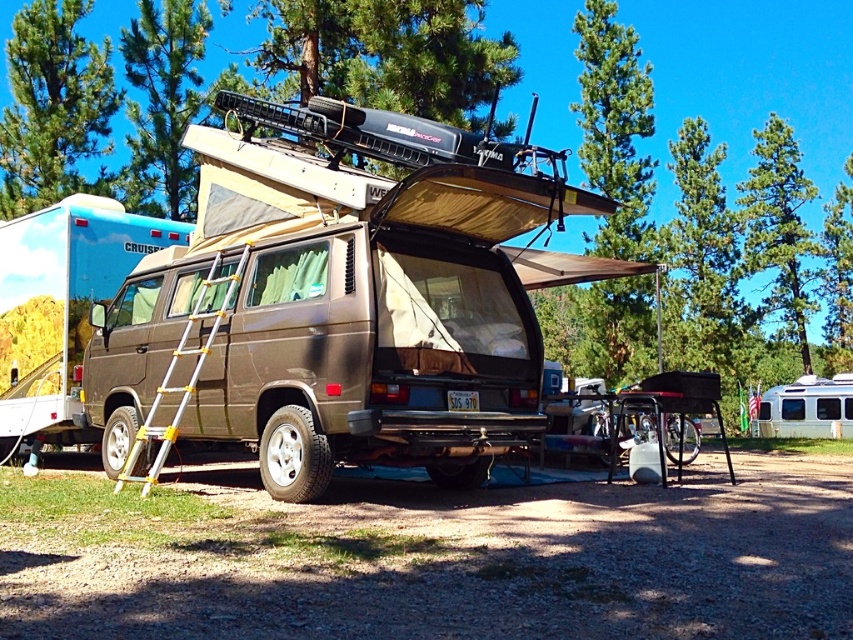
Question: Among these objects, which one is nearest to the camera?

Choices:
 (A) brown matte van at center
 (B) yellow aluminum ladder at side

Answer: (B)

Question: Can you confirm if brown matte van at center is thinner than yellow aluminum ladder at side?

Choices:
 (A) yes
 (B) no

Answer: (B)

Question: Which point is closer to the camera?

Choices:
 (A) (155, 396)
 (B) (106, 259)

Answer: (A)

Question: Which point is closer to the camera?

Choices:
 (A) pyautogui.click(x=155, y=397)
 (B) pyautogui.click(x=108, y=282)

Answer: (A)

Question: Can you confirm if brown matte van at center is smaller than yellow aluminum ladder at side?

Choices:
 (A) no
 (B) yes

Answer: (A)

Question: Can you confirm if brown matte van at center is positioned to the right of yellow aluminum ladder at side?

Choices:
 (A) no
 (B) yes

Answer: (A)